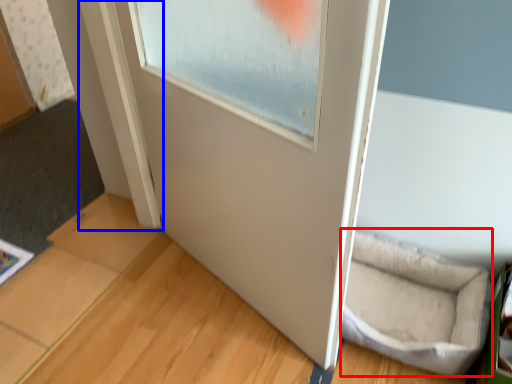
Question: Which object appears farthest to the camera in this image, wide (highlighted by a red box) or window frame (highlighted by a blue box)?

Choices:
 (A) wide
 (B) window frame

Answer: (B)